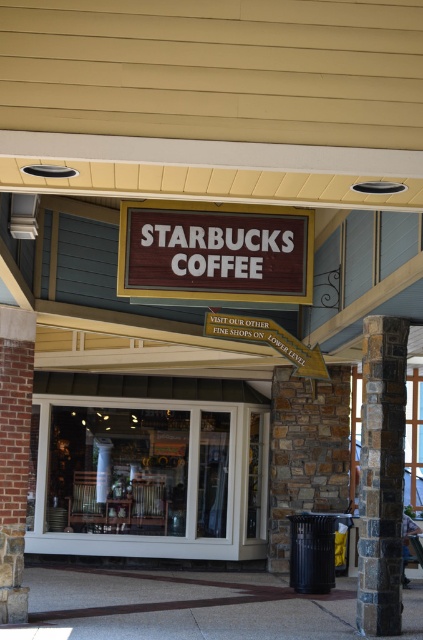
Does white glass door at center appear on the right side of stained stone column at right?

In fact, white glass door at center is to the left of stained stone column at right.

Between white glass door at center and stained stone column at right, which one is positioned higher?

stained stone column at right

Who is more forward, (54, 548) or (373, 396)?

Point (373, 396) is in front.

Where is `white glass door at center`? This screenshot has height=640, width=423. white glass door at center is located at coordinates (148, 477).

Measure the distance between point (222, 531) and camera.

14.48 meters

Which of these two, white glass door at center or wooden sign at center, stands taller?

Standing taller between the two is white glass door at center.

Where is `white glass door at center`? This screenshot has width=423, height=640. white glass door at center is located at coordinates pyautogui.click(x=148, y=477).

Between wooden sign at center and stained stone column at right, which one appears on the left side from the viewer's perspective?

From the viewer's perspective, wooden sign at center appears more on the left side.

Between wooden sign at center and stained stone column at right, which one appears on the right side from the viewer's perspective?

From the viewer's perspective, stained stone column at right appears more on the right side.

This screenshot has width=423, height=640. What do you see at coordinates (214, 252) in the screenshot?
I see `wooden sign at center` at bounding box center [214, 252].

You are a GUI agent. You are given a task and a screenshot of the screen. Output one action in this format:
    pyautogui.click(x=<x>, y=<y>)
    Task: Click on the wooden sign at center
    
    Given the screenshot: What is the action you would take?
    pyautogui.click(x=214, y=252)